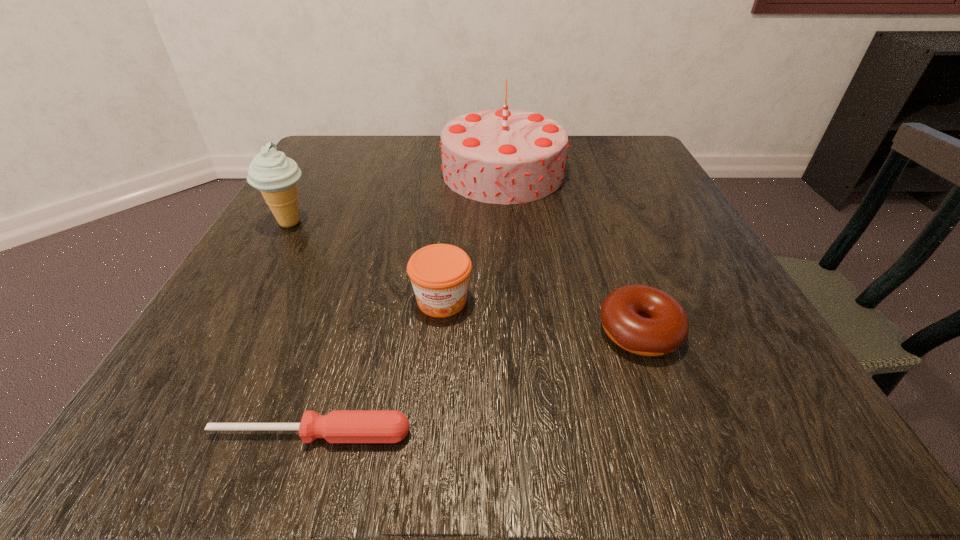
Find the location of `vacant space at the near edge of the desktop`. vacant space at the near edge of the desktop is located at coordinates (484, 398).

I want to click on vacant space at the left edge of the desktop, so click(x=304, y=215).

In the image, there is a desktop. In order to click on free space at the right edge in this screenshot , I will do `click(666, 282)`.

This screenshot has width=960, height=540. I want to click on vacant space at the far left corner of the desktop, so click(364, 165).

The image size is (960, 540). Identify the location of free space at the near left corner of the desktop. (295, 391).

This screenshot has height=540, width=960. I want to click on vacant region at the far right corner of the desktop, so click(x=630, y=176).

This screenshot has width=960, height=540. Identify the location of vacant space that is in between the farthest object and the jam. (472, 237).

You are a GUI agent. You are given a task and a screenshot of the screen. Output one action in this format:
    pyautogui.click(x=<x>, y=<y>)
    Task: Click on the free point between the fourth shortest object and the screwdriver
    
    Given the screenshot: What is the action you would take?
    pyautogui.click(x=300, y=328)

At what (x,y) coordinates should I click in order to perform the action: click on free space between the screwdriver and the leftmost object. Please return your answer as a coordinate pair (x, y). Looking at the image, I should click on (300, 328).

You are a GUI agent. You are given a task and a screenshot of the screen. Output one action in this format:
    pyautogui.click(x=<x>, y=<y>)
    Task: Click on the vacant region between the jam and the tallest object
    This screenshot has width=960, height=540.
    Given the screenshot: What is the action you would take?
    pyautogui.click(x=472, y=237)